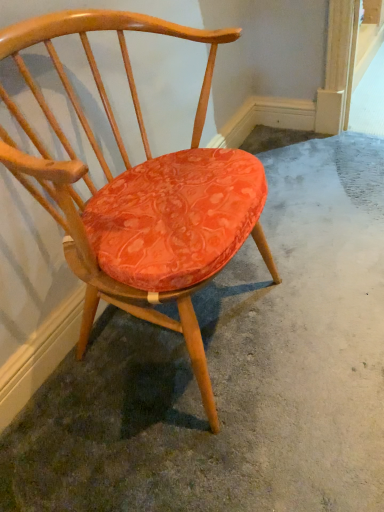
Locate an element on the screen. orange fabric cushion at center is located at coordinates (235, 371).

What do you see at coordinates (235, 371) in the screenshot?
I see `orange fabric cushion at center` at bounding box center [235, 371].

In order to face matte orange cushioned chair at center, should I rotate leftwards or rightwards?

Rotate your view left by about 5.325°.

At what (x,y) coordinates should I click in order to perform the action: click on matte orange cushioned chair at center. Please return your answer as a coordinate pair (x, y). Looking at the image, I should click on (140, 192).

What do you see at coordinates (140, 192) in the screenshot? Image resolution: width=384 pixels, height=512 pixels. I see `matte orange cushioned chair at center` at bounding box center [140, 192].

Identify the location of orange fabric cushion at center. Image resolution: width=384 pixels, height=512 pixels. (235, 371).

Considering the relative positions of orange fabric cushion at center and matte orange cushioned chair at center in the image provided, is orange fabric cushion at center to the left of matte orange cushioned chair at center from the viewer's perspective?

No, orange fabric cushion at center is not to the left of matte orange cushioned chair at center.

Between orange fabric cushion at center and matte orange cushioned chair at center, which one is positioned behind?

orange fabric cushion at center is further away from the camera.

Is point (234, 423) in front of point (92, 68)?

No.

From the image's perspective, which is above, orange fabric cushion at center or matte orange cushioned chair at center?

matte orange cushioned chair at center.

Consider the image. From a real-world perspective, which object stands above the other?

matte orange cushioned chair at center, from a real-world perspective.

Which object is wider, orange fabric cushion at center or matte orange cushioned chair at center?

With larger width is orange fabric cushion at center.

Is orange fabric cushion at center taller than matte orange cushioned chair at center?

In fact, orange fabric cushion at center may be shorter than matte orange cushioned chair at center.

Is orange fabric cushion at center smaller than matte orange cushioned chair at center?

Yes, orange fabric cushion at center is smaller than matte orange cushioned chair at center.

Do you think orange fabric cushion at center is within matte orange cushioned chair at center, or outside of it?

orange fabric cushion at center lies outside matte orange cushioned chair at center.

Would you say orange fabric cushion at center is a long distance from matte orange cushioned chair at center?

No, orange fabric cushion at center is in close proximity to matte orange cushioned chair at center.

Consider the image. Is orange fabric cushion at center facing away from matte orange cushioned chair at center?

orange fabric cushion at center does not have its back to matte orange cushioned chair at center.

How many degrees apart are the facing directions of orange fabric cushion at center and matte orange cushioned chair at center?

The angular difference between orange fabric cushion at center and matte orange cushioned chair at center is 6.91e-05 degrees.

Measure the distance from orange fabric cushion at center to matte orange cushioned chair at center.

A distance of 16.13 inches exists between orange fabric cushion at center and matte orange cushioned chair at center.

The image size is (384, 512). What are the coordinates of `concrete behind the matte orange cushioned chair at center` in the screenshot? It's located at (235, 371).

Considering the positions of objects matte orange cushioned chair at center and orange fabric cushion at center in the image provided, who is more to the left, matte orange cushioned chair at center or orange fabric cushion at center?

matte orange cushioned chair at center is more to the left.

From the picture: Which is behind, matte orange cushioned chair at center or orange fabric cushion at center?

orange fabric cushion at center is behind.

Which point is more forward, (186, 255) or (91, 422)?

Positioned in front is point (186, 255).

From the image's perspective, is matte orange cushioned chair at center located above orange fabric cushion at center?

Yes, from the image's perspective, matte orange cushioned chair at center is on top of orange fabric cushion at center.

From a real-world perspective, does matte orange cushioned chair at center sit lower than orange fabric cushion at center?

No, from a real-world perspective, matte orange cushioned chair at center is not under orange fabric cushion at center.

Considering the sizes of matte orange cushioned chair at center and orange fabric cushion at center in the image, is matte orange cushioned chair at center wider or thinner than orange fabric cushion at center?

Considering their sizes, matte orange cushioned chair at center looks slimmer than orange fabric cushion at center.

Considering the sizes of objects matte orange cushioned chair at center and orange fabric cushion at center in the image provided, who is taller, matte orange cushioned chair at center or orange fabric cushion at center?

With more height is matte orange cushioned chair at center.

Is matte orange cushioned chair at center bigger than orange fabric cushion at center?

Yes, matte orange cushioned chair at center is bigger than orange fabric cushion at center.

In the scene shown: Do you think matte orange cushioned chair at center is within orange fabric cushion at center, or outside of it?

matte orange cushioned chair at center exists outside the volume of orange fabric cushion at center.

Is matte orange cushioned chair at center far from orange fabric cushion at center?

Actually, matte orange cushioned chair at center and orange fabric cushion at center are a little close together.

Is matte orange cushioned chair at center turned away from orange fabric cushion at center?

No, matte orange cushioned chair at center is not facing the opposite direction of orange fabric cushion at center.

How different are the orientations of matte orange cushioned chair at center and orange fabric cushion at center in degrees?

6.91e-05 degrees separate the facing orientations of matte orange cushioned chair at center and orange fabric cushion at center.

Locate an element on the screen. This screenshot has width=384, height=512. chair above the orange fabric cushion at center (from the image's perspective) is located at coordinates (140, 192).

Identify the location of concrete lying below the matte orange cushioned chair at center (from the image's perspective). The width and height of the screenshot is (384, 512). (235, 371).

Where is `chair that is on the left side of orange fabric cushion at center`? The image size is (384, 512). chair that is on the left side of orange fabric cushion at center is located at coordinates (140, 192).